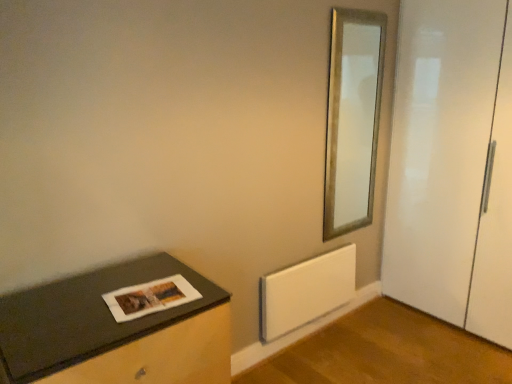
Locate an element on the screen. This screenshot has height=384, width=512. free area below white matte radiator at lower center (from a real-world perspective) is located at coordinates point(311,334).